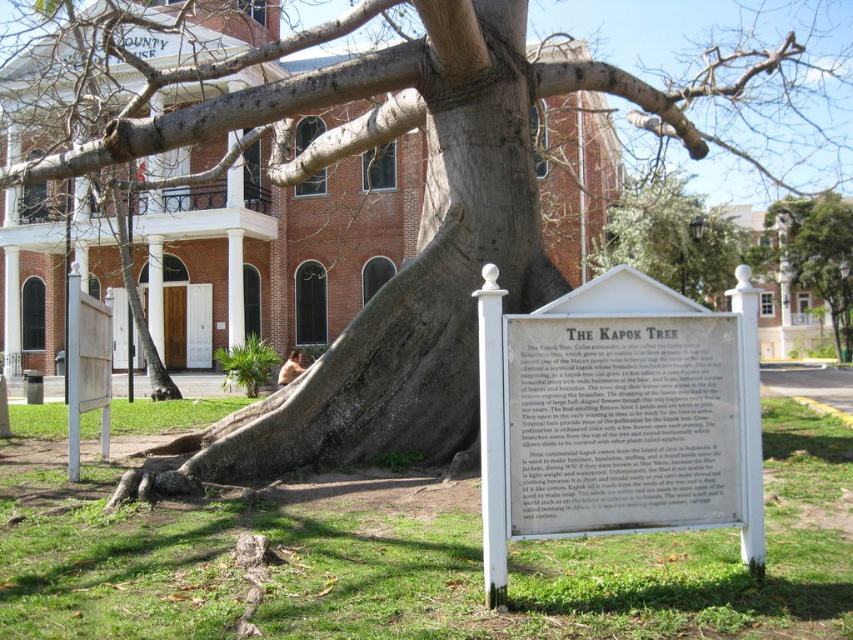
Which of these two, white wooden sign at center or brick building at center, stands taller?

brick building at center is taller.

Between point (641, 291) and point (373, 227), which one is positioned behind?

The point (373, 227) is more distant.

This screenshot has height=640, width=853. I want to click on white wooden sign at center, so click(x=618, y=416).

Can you confirm if brick building at center is positioned above green leafy tree at upper right?

Indeed, brick building at center is positioned over green leafy tree at upper right.

Who is more forward, (282,230) or (784,250)?

Positioned in front is point (282,230).

The height and width of the screenshot is (640, 853). I want to click on brick building at center, so click(57, 86).

Is white wooden sign at center taller than white paper sign at center?

Correct, white wooden sign at center is much taller as white paper sign at center.

Is white wooden sign at center above white paper sign at center?

Actually, white wooden sign at center is below white paper sign at center.

Locate an element on the screen. white wooden sign at center is located at coordinates pyautogui.click(x=618, y=416).